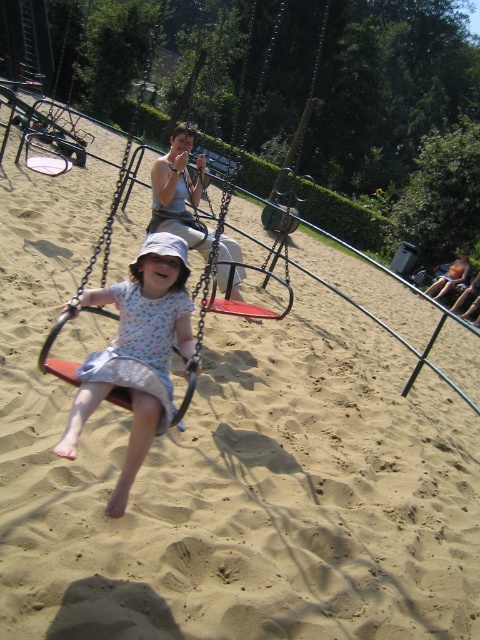
Question: Which point is farther to the camera?

Choices:
 (A) (92, 384)
 (B) (162, 188)

Answer: (B)

Question: Which point is closer to the camera?

Choices:
 (A) floral cotton dress at center
 (B) floral fabric dress at center

Answer: (A)

Question: Does floral cotton dress at center appear on the left side of floral fabric dress at center?

Choices:
 (A) no
 (B) yes

Answer: (A)

Question: Does floral cotton dress at center appear under floral fabric dress at center?

Choices:
 (A) no
 (B) yes

Answer: (B)

Question: Can you confirm if floral cotton dress at center is wider than floral fabric dress at center?

Choices:
 (A) no
 (B) yes

Answer: (B)